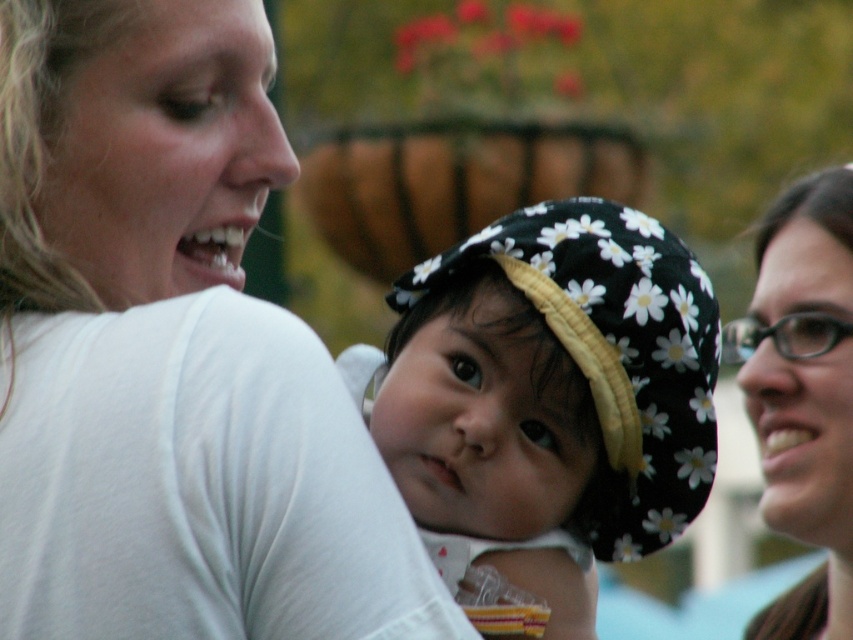
Question: Which of the following is the closest to the observer?

Choices:
 (A) pyautogui.click(x=782, y=237)
 (B) pyautogui.click(x=552, y=218)
 (C) pyautogui.click(x=300, y=348)

Answer: (C)

Question: Where is white matte shirt at upper left located in relation to floral fabric hat at center in the image?

Choices:
 (A) above
 (B) below

Answer: (A)

Question: Which point is farther to the camera?

Choices:
 (A) brown matte glasses at right
 (B) white matte shirt at upper left

Answer: (A)

Question: Can you confirm if floral fabric hat at center is positioned to the left of brown matte glasses at right?

Choices:
 (A) yes
 (B) no

Answer: (A)

Question: Which object is farther from the camera taking this photo?

Choices:
 (A) white matte shirt at upper left
 (B) brown matte glasses at right
 (C) floral fabric hat at center

Answer: (B)

Question: From the image, what is the correct spatial relationship of white matte shirt at upper left in relation to brown matte glasses at right?

Choices:
 (A) left
 (B) right

Answer: (A)